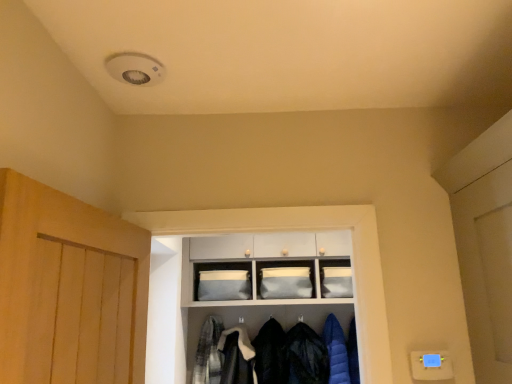
Question: Is dark blue quilted jacket at center, the 4th clothing positioned from the left, shorter than white fluffy coat at lower center, which appears as the second clothing when viewed from the left?

Choices:
 (A) yes
 (B) no

Answer: (B)

Question: Does dark blue quilted jacket at center, the second clothing in the right-to-left sequence, come behind white fluffy coat at lower center, which is the 4th clothing from right to left?

Choices:
 (A) yes
 (B) no

Answer: (A)

Question: Does dark blue quilted jacket at center, the 4th clothing positioned from the left, have a lesser width compared to white fluffy coat at lower center, which appears as the second clothing when viewed from the left?

Choices:
 (A) no
 (B) yes

Answer: (B)

Question: Can you confirm if dark blue quilted jacket at center, the 4th clothing positioned from the left, is wider than white fluffy coat at lower center, which appears as the second clothing when viewed from the left?

Choices:
 (A) no
 (B) yes

Answer: (A)

Question: Can you confirm if dark blue quilted jacket at center, the 4th clothing positioned from the left, is positioned to the right of white fluffy coat at lower center, which appears as the second clothing when viewed from the left?

Choices:
 (A) yes
 (B) no

Answer: (A)

Question: Is dark blue quilted jacket at center, the second clothing in the right-to-left sequence, turned away from white fluffy coat at lower center, which appears as the second clothing when viewed from the left?

Choices:
 (A) yes
 (B) no

Answer: (B)

Question: From a real-world perspective, is white fluffy coat at lower center, which is the 4th clothing from right to left, positioned over dark blue quilted jacket at center, the second clothing in the right-to-left sequence, based on gravity?

Choices:
 (A) no
 (B) yes

Answer: (B)

Question: Is white fluffy coat at lower center, which appears as the second clothing when viewed from the left, located outside dark blue quilted jacket at center, the second clothing in the right-to-left sequence?

Choices:
 (A) no
 (B) yes

Answer: (B)

Question: Is white fluffy coat at lower center, which appears as the second clothing when viewed from the left, facing towards dark blue quilted jacket at center, the 4th clothing positioned from the left?

Choices:
 (A) yes
 (B) no

Answer: (B)

Question: Is dark blue quilted jacket at center, the 4th clothing positioned from the left, at the back of white fluffy coat at lower center, which appears as the second clothing when viewed from the left?

Choices:
 (A) no
 (B) yes

Answer: (A)

Question: Does white fluffy coat at lower center, which appears as the second clothing when viewed from the left, have a greater height compared to dark blue quilted jacket at center, the second clothing in the right-to-left sequence?

Choices:
 (A) yes
 (B) no

Answer: (B)

Question: Does white fluffy coat at lower center, which appears as the second clothing when viewed from the left, have a smaller size compared to dark blue quilted jacket at center, the 4th clothing positioned from the left?

Choices:
 (A) yes
 (B) no

Answer: (A)

Question: Is plaid fabric shirt at center, which is counted as the 5th clothing, starting from the right, positioned with its back to gray fabric storage at center, which ranks as the second shelf in top-to-bottom order?

Choices:
 (A) yes
 (B) no

Answer: (A)